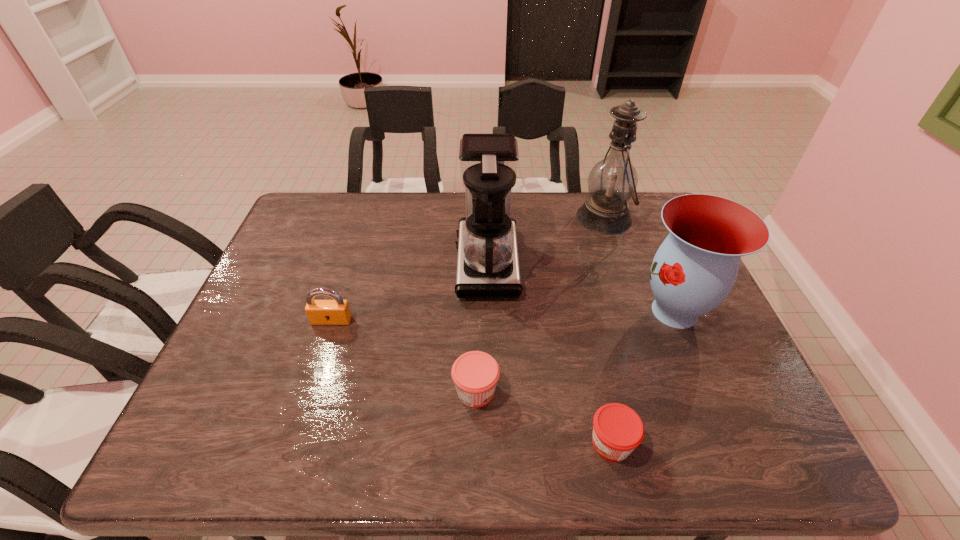
Where is `vacant area that lies between the oil lamp and the nearer jam`? Image resolution: width=960 pixels, height=540 pixels. vacant area that lies between the oil lamp and the nearer jam is located at coordinates (608, 330).

Where is `free space between the third tallest object and the nearer jam`? The width and height of the screenshot is (960, 540). free space between the third tallest object and the nearer jam is located at coordinates (643, 377).

Image resolution: width=960 pixels, height=540 pixels. Identify the location of vacant space that's between the coffee maker and the oil lamp. (545, 240).

At what (x,y) coordinates should I click in order to perform the action: click on vacant space that's between the fourth object from left to right and the second nearest object. Please return your answer as a coordinate pair (x, y). This screenshot has width=960, height=540. Looking at the image, I should click on (543, 417).

At what (x,y) coordinates should I click in order to perform the action: click on unoccupied area between the nearest object and the farther jam. Please return your answer as a coordinate pair (x, y). Looking at the image, I should click on (543, 417).

Find the location of a particular element. free area in between the coffee maker and the farther jam is located at coordinates (481, 327).

You are a GUI agent. You are given a task and a screenshot of the screen. Output one action in this format:
    pyautogui.click(x=<x>, y=<y>)
    Task: Click on the vacant area between the fifth farthest object and the padlock
    The height and width of the screenshot is (540, 960).
    Given the screenshot: What is the action you would take?
    pyautogui.click(x=404, y=356)

This screenshot has width=960, height=540. I want to click on vacant region between the right jam and the oil lamp, so click(x=608, y=330).

The image size is (960, 540). What are the coordinates of `vacant point located between the second nearest object and the nearer jam` in the screenshot? It's located at (543, 417).

Locate an element on the screen. object that can be found as the second closest to the nearer jam is located at coordinates (695, 268).